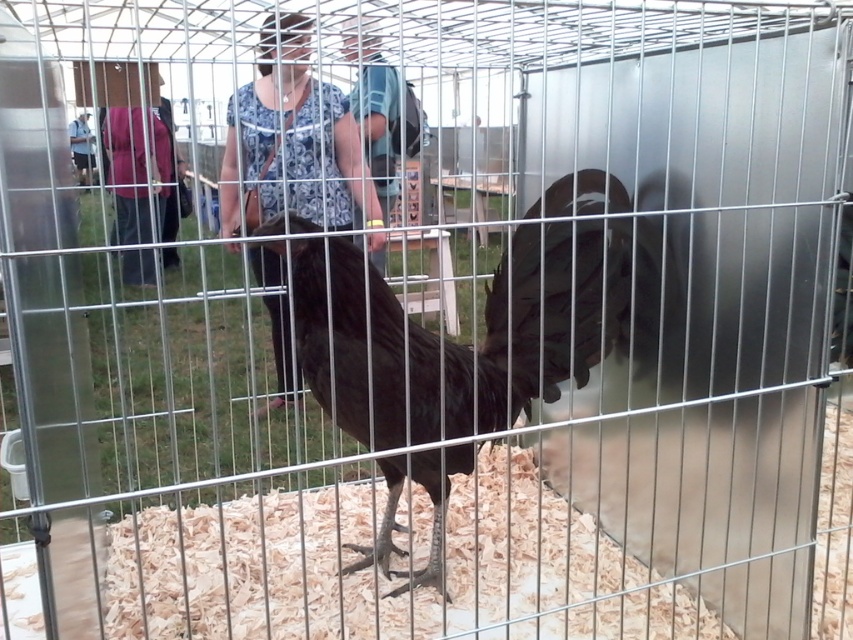
Who is higher up, shiny black rooster at center or blue floral shirt at center?

blue floral shirt at center is higher up.

Can you confirm if shiny black rooster at center is taller than blue floral shirt at center?

No, shiny black rooster at center is not taller than blue floral shirt at center.

The image size is (853, 640). What are the coordinates of `shiny black rooster at center` in the screenshot? It's located at (x=525, y=330).

Does blue floral shirt at center have a lesser width compared to denim jacket at upper left?

Incorrect, blue floral shirt at center's width is not less than denim jacket at upper left's.

Who is more forward, (231, 225) or (80, 166)?

Point (231, 225) is in front.

Where is `blue floral shirt at center`? The image size is (853, 640). blue floral shirt at center is located at coordinates (292, 141).

Does shiny black rooster at center have a greater height compared to denim jacket at upper left?

Correct, shiny black rooster at center is much taller as denim jacket at upper left.

Does point (590, 342) come farther from viewer compared to point (88, 179)?

No.

Which is behind, point (602, 262) or point (79, 124)?

Point (79, 124)

Where is `shiny black rooster at center`? This screenshot has width=853, height=640. shiny black rooster at center is located at coordinates (525, 330).